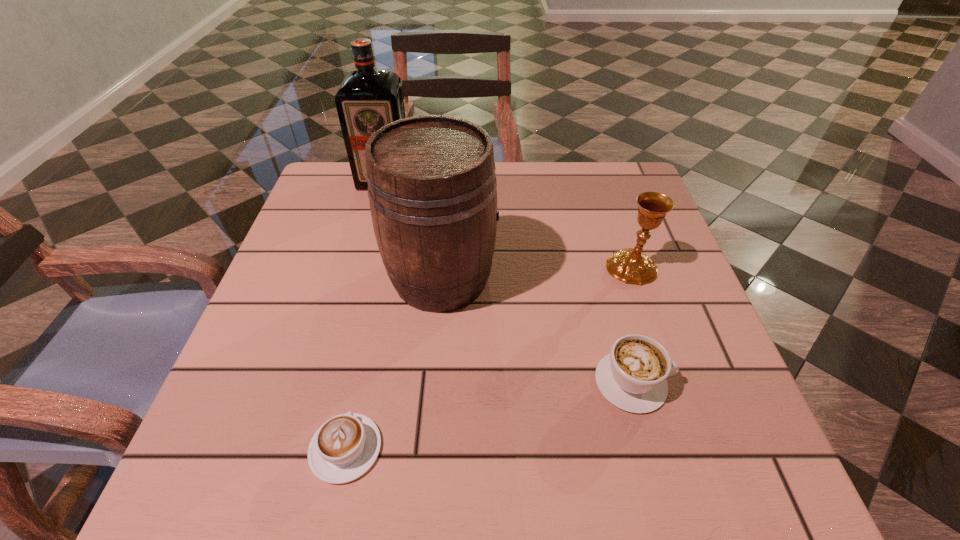
Image resolution: width=960 pixels, height=540 pixels. In order to click on vacant area at the far edge of the desktop in this screenshot , I will do `click(557, 196)`.

The image size is (960, 540). Identify the location of free region at the near edge. (570, 492).

This screenshot has height=540, width=960. I want to click on free point at the left edge, so click(298, 291).

In order to click on vacant space at the right edge of the desktop in this screenshot , I will do `click(704, 369)`.

Where is `blank space at the far left corner of the desktop`? blank space at the far left corner of the desktop is located at coordinates pos(358,204).

In the image, there is a desktop. What are the coordinates of `vacant space at the far right corner` in the screenshot? It's located at (636, 179).

Locate an element on the screen. The height and width of the screenshot is (540, 960). unoccupied position between the farther cappuccino and the third shortest object is located at coordinates (632, 325).

Identify the location of blank region between the cider and the third tallest object. (537, 272).

Identify the location of vacant area between the taller cappuccino and the third tallest object. (632, 325).

Identify the location of vacant space that's between the shortest object and the liquor. pyautogui.click(x=366, y=314).